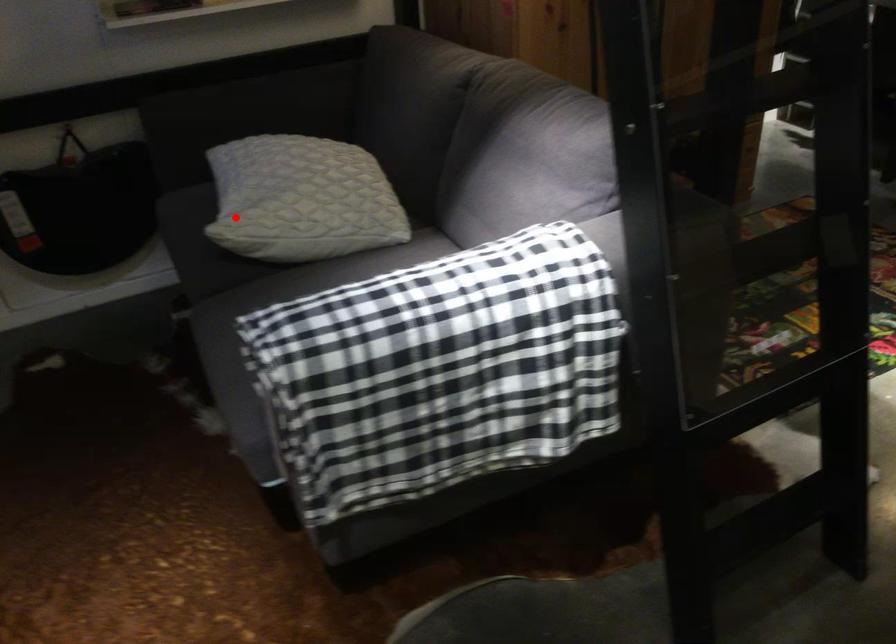
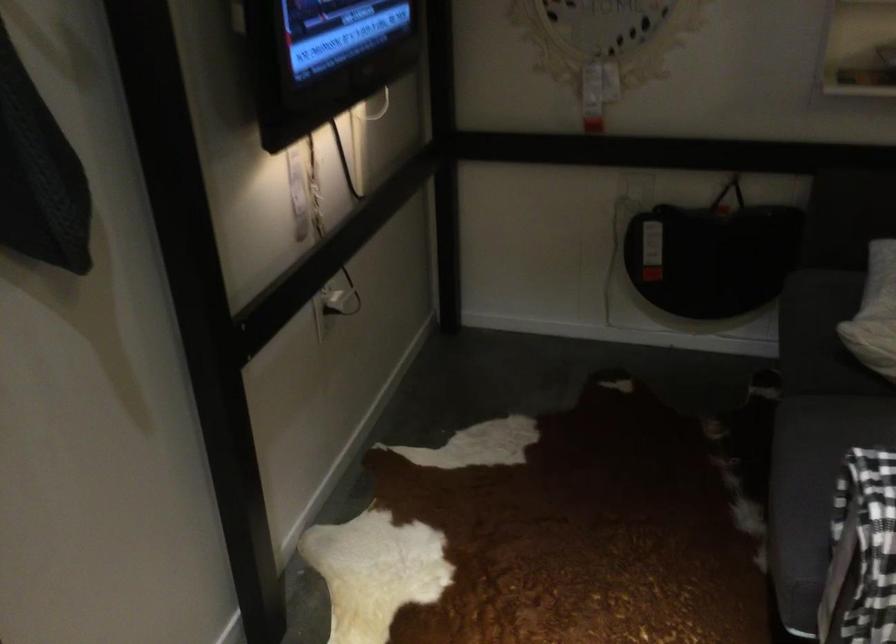
Where in the second image is the point corresponding to the highlighted location from the first image?

(874, 313)